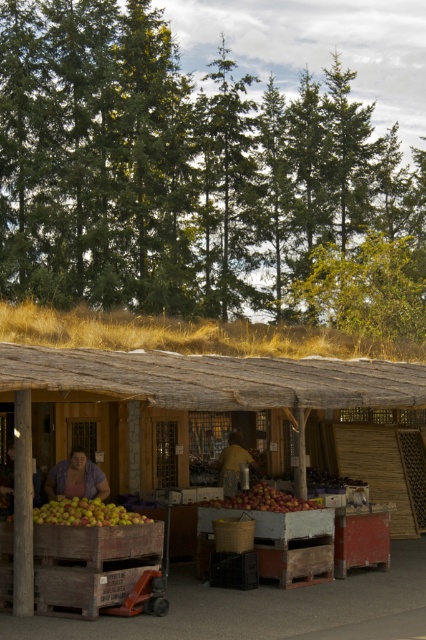
Does yellowish matte apples at lower left have a greater width compared to matte purple shirt at center?

Yes.

Is yellowish matte apples at lower left above matte purple shirt at center?

No, yellowish matte apples at lower left is not above matte purple shirt at center.

Who is more forward, (100, 509) or (78, 445)?

Point (100, 509) is in front.

The height and width of the screenshot is (640, 426). I want to click on yellowish matte apples at lower left, so click(x=86, y=513).

Can you confirm if wooden crates of apples at center is positioned to the right of brown fabric bag at center?

Yes, wooden crates of apples at center is to the right of brown fabric bag at center.

Find the location of `wooden crates of apples at center`. wooden crates of apples at center is located at coordinates (181, 403).

Where is `wooden crates of apples at center`? This screenshot has width=426, height=640. wooden crates of apples at center is located at coordinates (181, 403).

Between wooden crates of apples at center and matte purple shirt at center, which one appears on the right side from the viewer's perspective?

From the viewer's perspective, wooden crates of apples at center appears more on the right side.

Is wooden crates of apples at center to the left of matte purple shirt at center from the viewer's perspective?

Incorrect, wooden crates of apples at center is not on the left side of matte purple shirt at center.

Between point (420, 372) and point (71, 497), which one is positioned behind?

Positioned behind is point (420, 372).

Find the location of a particular element. The width and height of the screenshot is (426, 640). wooden crates of apples at center is located at coordinates (181, 403).